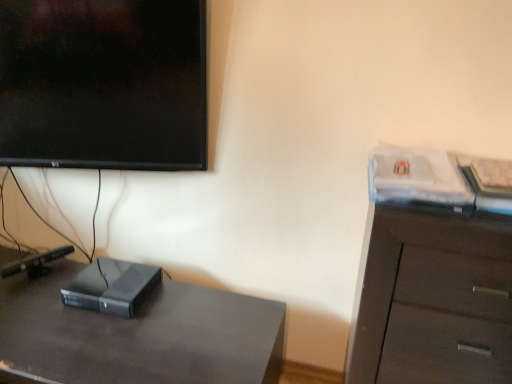
Identify the location of free spot in front of black matte computer at lower left. The width and height of the screenshot is (512, 384). (90, 338).